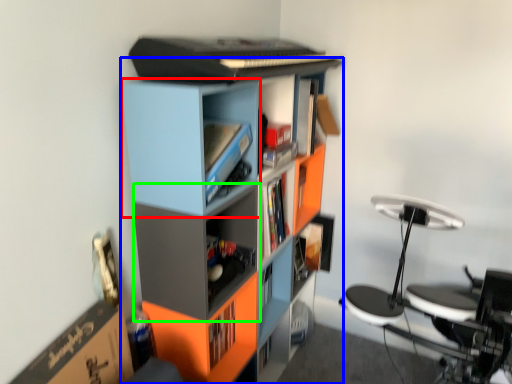
Question: Which object is the closest to the cabinet (highlighted by a red box)? Choose among these: bookcase (highlighted by a blue box) or shelf (highlighted by a green box).

Choices:
 (A) bookcase
 (B) shelf

Answer: (A)